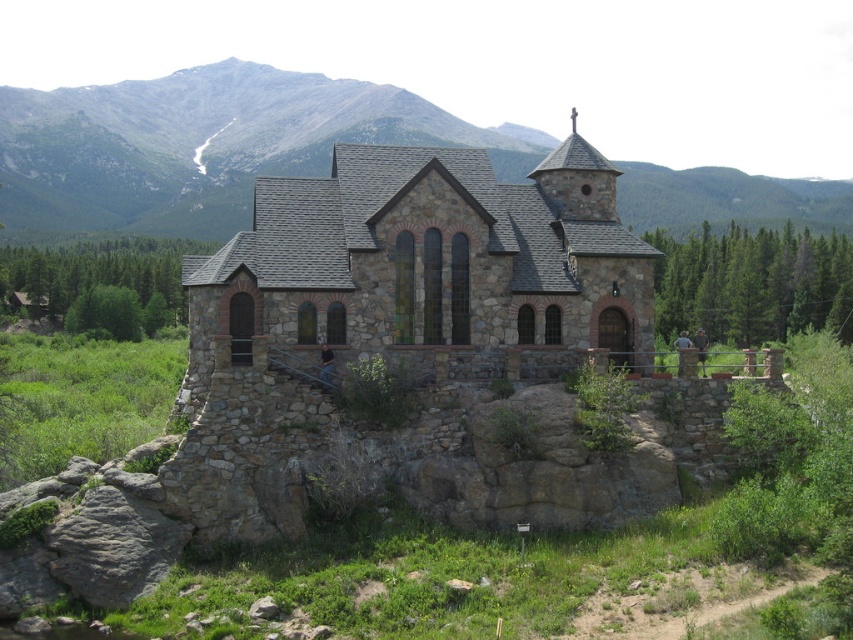
You are standing at the base of the stone church at center and want to take a photo. If your camera has a maximum focus range of 30 meters, will it be able to capture the church clearly from your current position?

The stone church at center and camera are 28.50 meters apart from each other. Since the distance is within the camera maximum focus range of 30 meters, the camera can capture the stone church at center clearly.

You are a hiker planning to take a photo of the stone church at center and the gray stone mountain at upper center. Which one should you zoom in on to capture more details without moving your camera position?

The stone church at center is smaller than the gray stone mountain at upper center, so you should zoom in on the stone church at center to capture more details without moving your camera position.